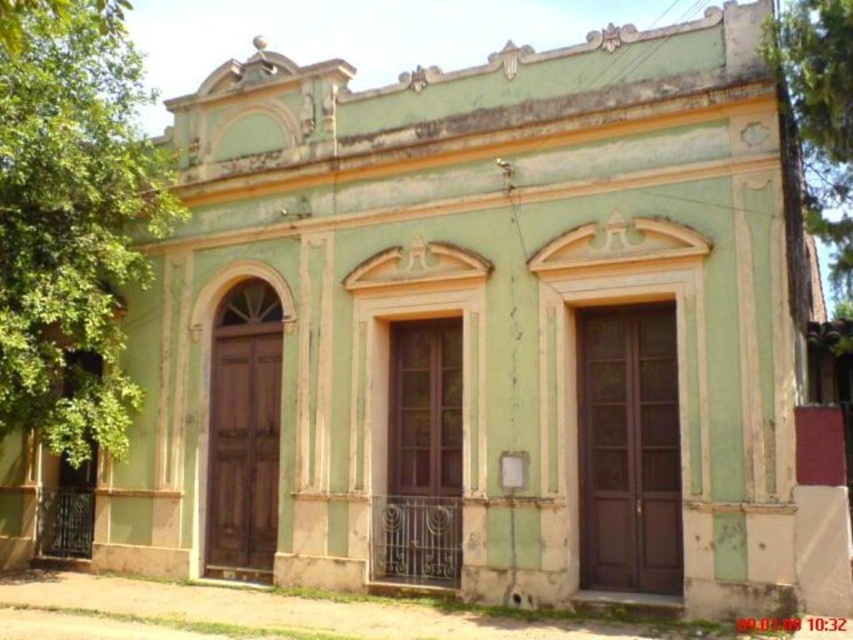
Does green leafy tree at left appear on the left side of green textured tree at upper right?

Yes, green leafy tree at left is to the left of green textured tree at upper right.

Does green leafy tree at left appear over green textured tree at upper right?

Yes, green leafy tree at left is above green textured tree at upper right.

Based on the photo, who is more distant from viewer, (x=80, y=324) or (x=815, y=100)?

Positioned behind is point (x=80, y=324).

Identify the location of green leafy tree at left. (73, 220).